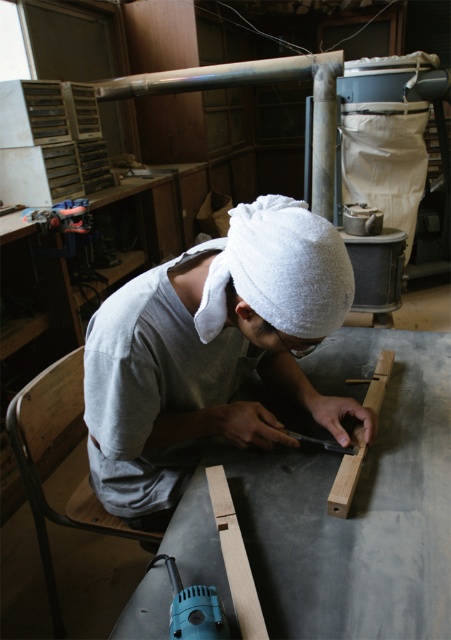
Can you confirm if gray cotton towel at center is positioned to the left of light wood plank at center?

Indeed, gray cotton towel at center is positioned on the left side of light wood plank at center.

Which is in front, point (104, 403) or point (366, 404)?

Point (104, 403) is in front.

You are a GUI agent. You are given a task and a screenshot of the screen. Output one action in this format:
    pyautogui.click(x=<x>, y=<y>)
    Task: Click on the gray cotton towel at center
    The height and width of the screenshot is (640, 451).
    Given the screenshot: What is the action you would take?
    pyautogui.click(x=211, y=352)

Who is higher up, gray cotton towel at center or white towel at center?

white towel at center

Which is more to the right, gray cotton towel at center or white towel at center?

white towel at center is more to the right.

Is point (133, 296) positioned in front of point (328, 237)?

No, it is not.

This screenshot has height=640, width=451. I want to click on gray cotton towel at center, so click(211, 352).

Describe the element at coordinates (280, 269) in the screenshot. I see `white towel at center` at that location.

Does point (326, 272) lie behind point (228, 529)?

That is False.

Who is more distant from viewer, (337, 241) or (211, 468)?

The point (211, 468) is behind.

Locate an element on the screen. white towel at center is located at coordinates click(280, 269).